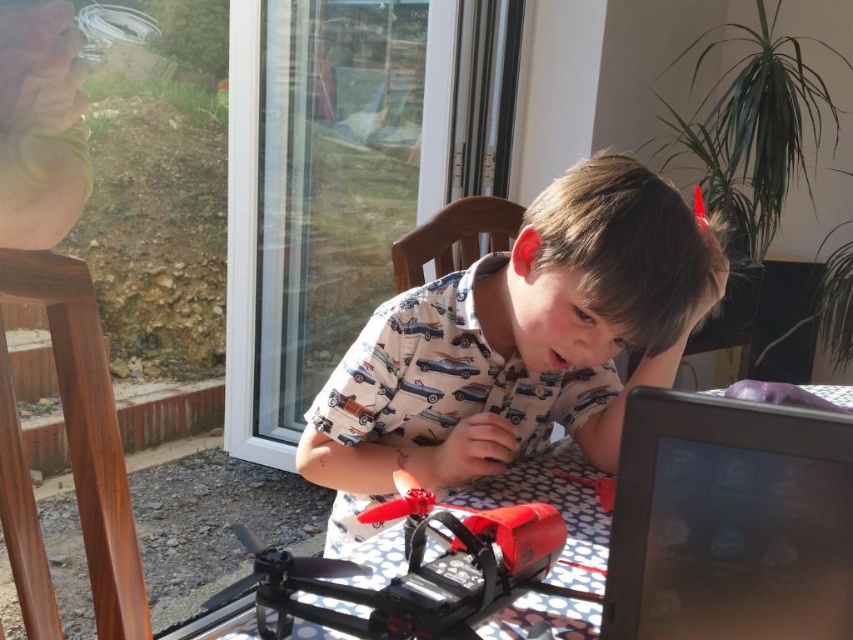
In the scene shown: You are a delivery robot trying to navigate around the table. The shiny red drone at center and the matte black drone at center are in your path. Which direction should you move to avoid both drones?

The shiny red drone at center is to the right of the matte black drone at center, so moving to the left would avoid both drones.

You are standing in a room where there is a transparent glass screen door at upper center. There is a point marked at coordinates (323, 188). Is this point located on the transparent glass screen door at upper center?

Yes, the point marked at coordinates (323, 188) is located on the transparent glass screen door at upper center as stated in the description.